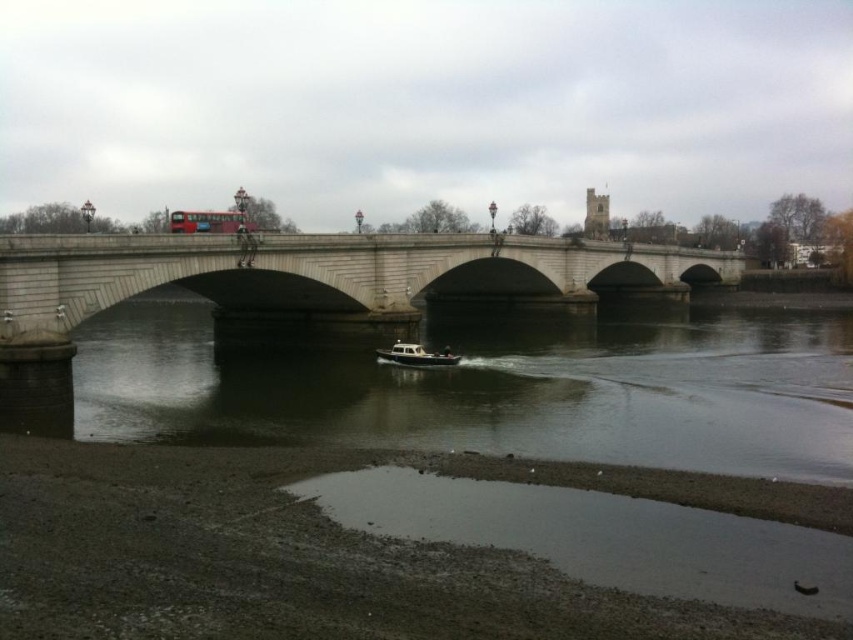
You are standing at the riverside and want to determine the relative positions of two points marked in the scene. Which point is closer to you, point (306,300) or point (408,342)?

Point (306,300) is further to the viewer than point (408,342), so the closer point to you is point (408,342).

You are a tourist standing on the riverside path and want to take a photo of the red metallic bus at center and the stone bridge at center. Which object should you focus on first to ensure both are in frame?

The stone bridge at center is located below the red metallic bus at center, so you should focus on the red metallic bus at center first to ensure both are in frame.

Based on the photo, you are planning to cross the stone bridge with a delivery truck that is 3 meters wide. The bridge has a weight limit of 5 tons. Can the truck safely pass through the bridge while avoiding the red metallic bus at center and the white matte boat at center?

The red metallic bus at center is wider than the white matte boat at center. However, the question about the truck passing safely requires information about the bridge width and weight capacity, which are not provided in the scene description. Therefore, I cannot determine if the truck can safely pass through the bridge.